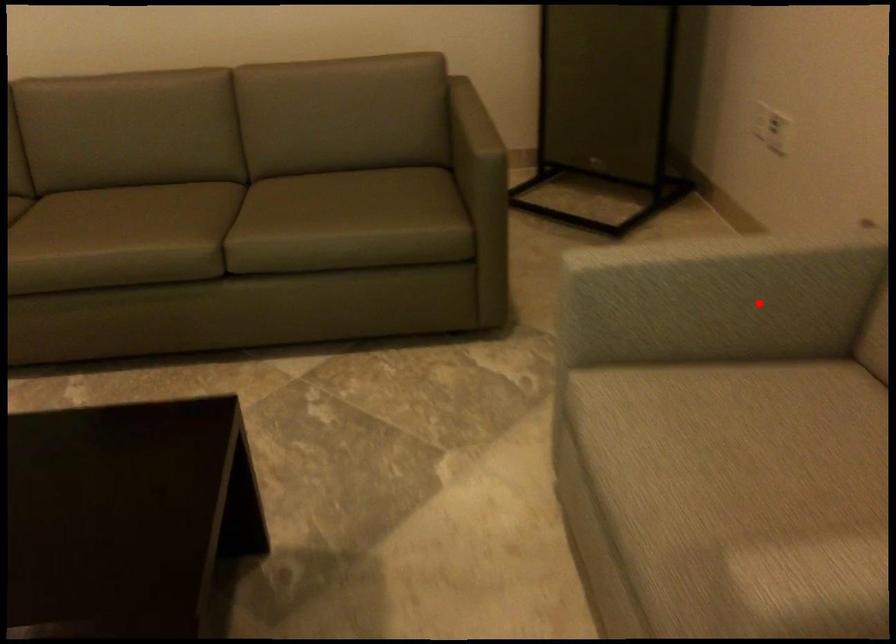
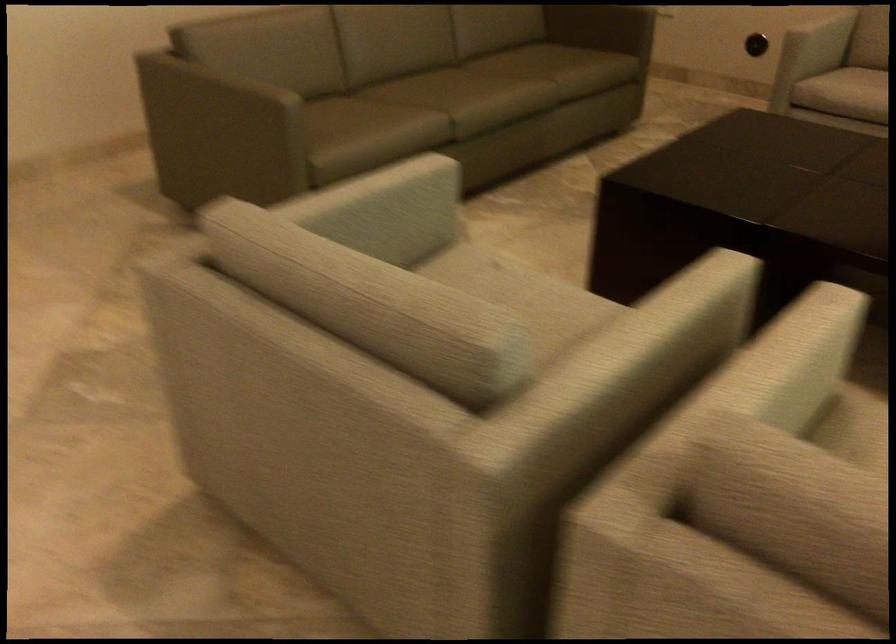
In the second image, find the point that corresponds to the highlighted location in the first image.

(821, 35)